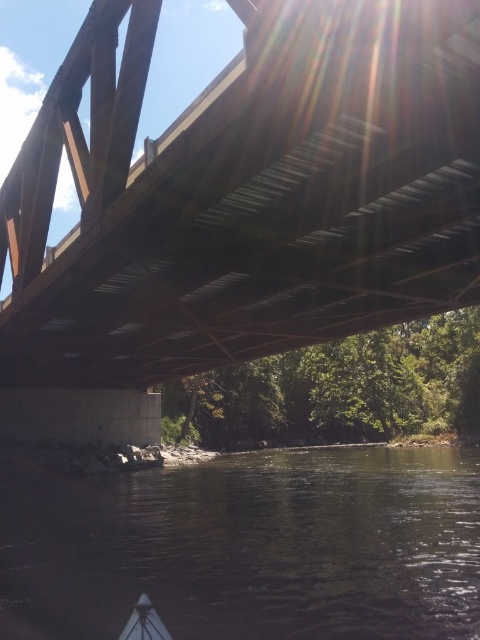
In the scene shown: You are on a boat and want to know if you can see the white plastic boat at lower center through the dark water at lower center. Can you?

The white plastic boat at lower center is behind the dark water at lower center, so you cannot see it through the water.

Looking at this image, you are a photographer taking a picture from a boat under the bridge. You want to ensure the metallic brown bridge at upper center is clearly visible in the reflection of the dark water at lower center. Is the bridge positioned in a way that its reflection would be visible in the water?

Yes, the metallic brown bridge at upper center is positioned over dark water at lower center, so its reflection should be visible in the water.

You are standing on a boat in the middle of the river and notice the metallic brown bridge at upper center and the dark water at lower center. Which object is positioned to the left side from your viewpoint?

The metallic brown bridge at upper center is to the left of dark water at lower center, so the metallic brown bridge at upper center is positioned to the left side from your viewpoint.